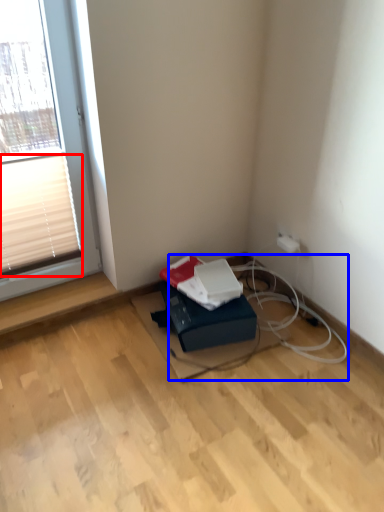
Question: Among these objects, which one is nearest to the camera, blind (highlighted by a red box) or cable (highlighted by a blue box)?

Choices:
 (A) blind
 (B) cable

Answer: (A)